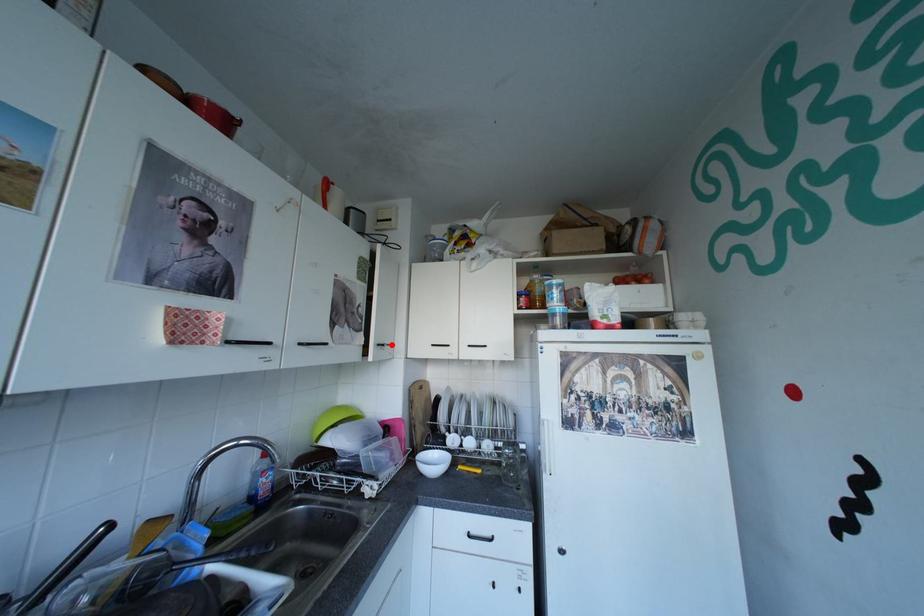
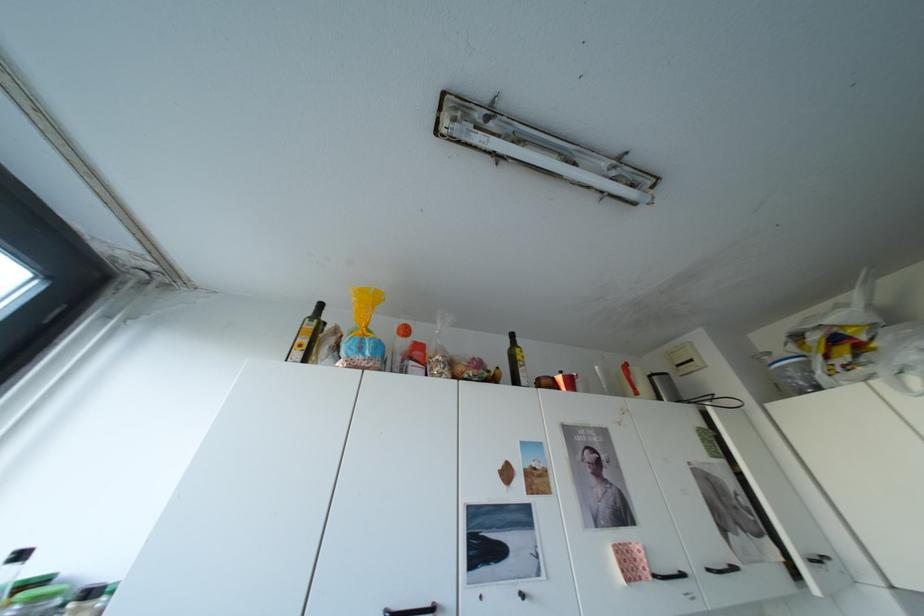
Question: I am providing you with two images of the same scene from different viewpoints. A red point is marked on the first image. Can you still see the location of the red point in image 2?

Choices:
 (A) Yes
 (B) No

Answer: (A)